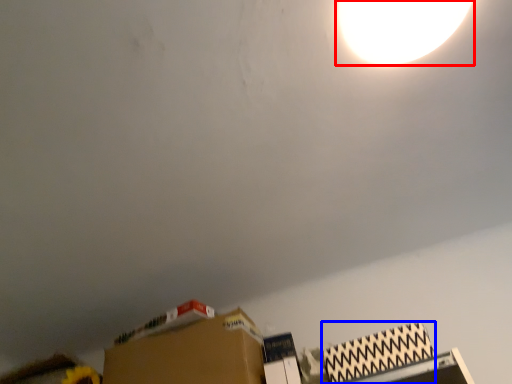
Question: Which object is closer to the camera taking this photo, lamp (highlighted by a red box) or cardboard box (highlighted by a blue box)?

Choices:
 (A) lamp
 (B) cardboard box

Answer: (A)